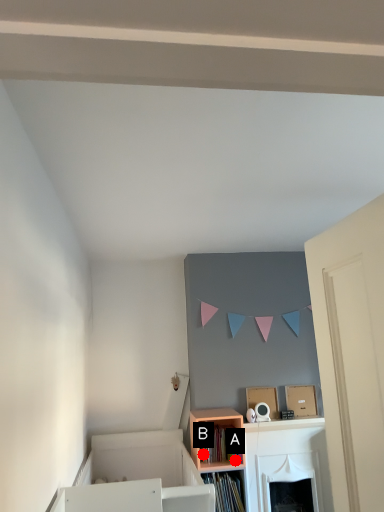
Question: Two points are circled on the image, labeled by A and B beside each circle. Which point is farther to the camera?

Choices:
 (A) A is further
 (B) B is further

Answer: (A)